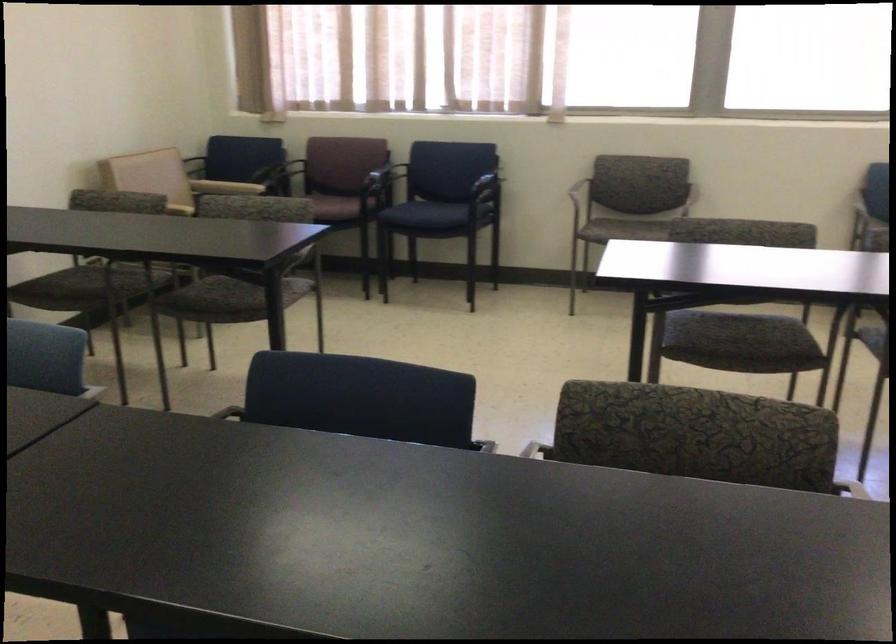
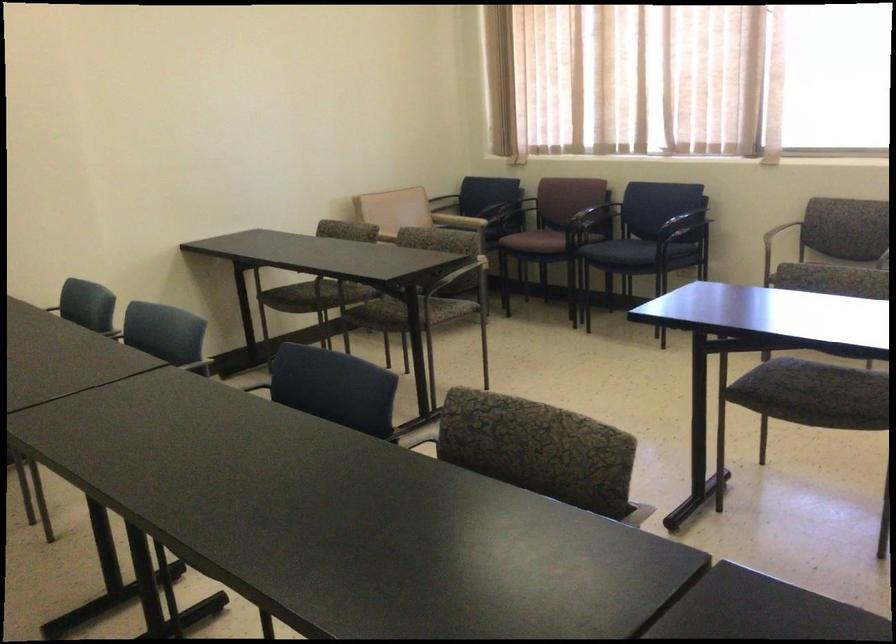
Locate, in the second image, the point that corresponds to [659,422] in the first image.

(538, 449)